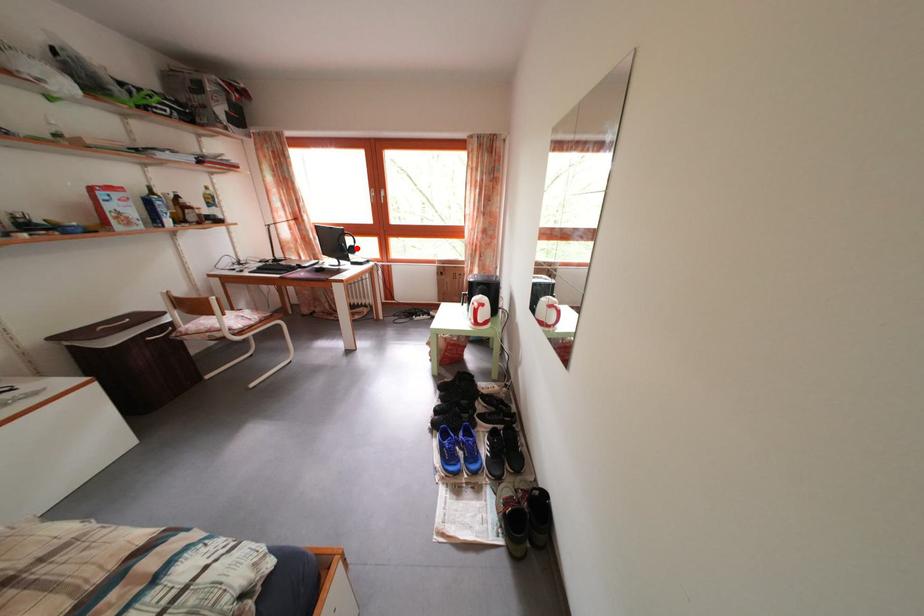
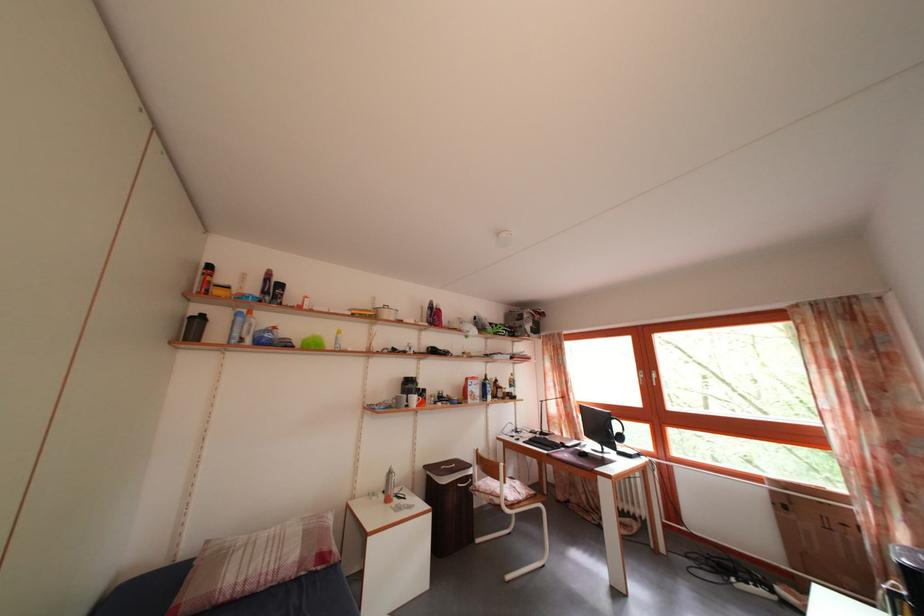
Question: I am providing you with two images of the same scene from different viewpoints. Image1 has a red point marked. In image2, the corresponding 3D location appears at what relative position? Reply with the corresponding letter.

Choices:
 (A) Closer
 (B) Farther

Answer: (B)